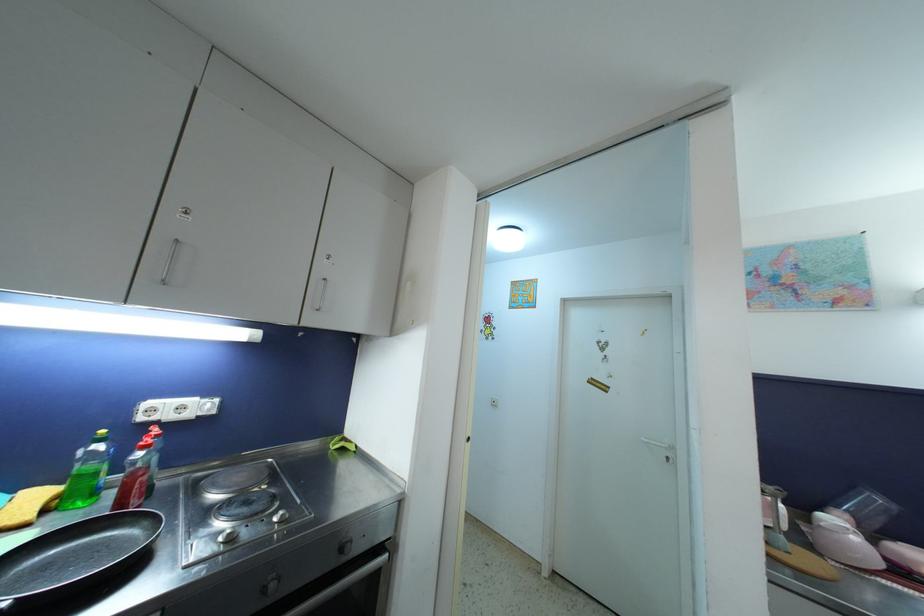
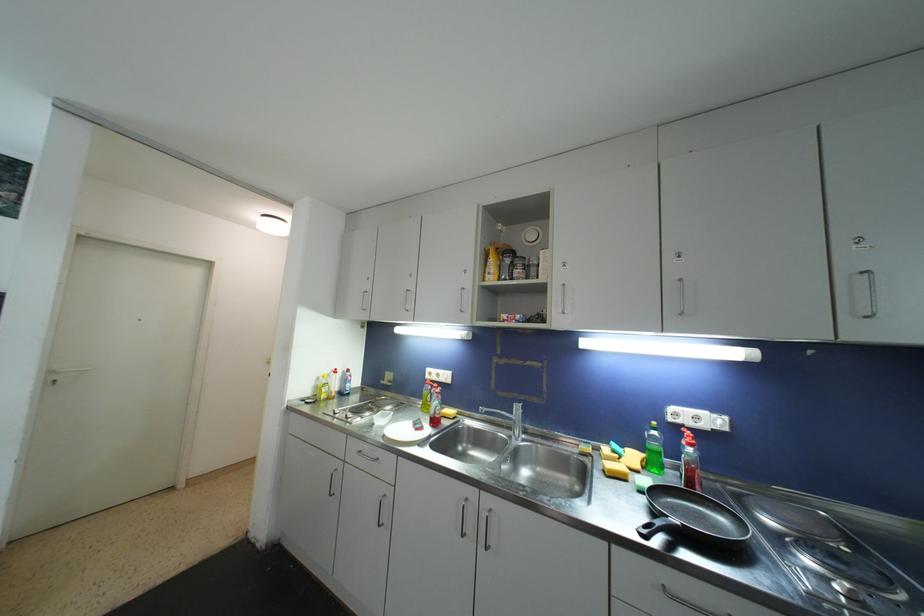
Locate, in the second image, the point that corresponds to [102,448] in the first image.

(658, 436)